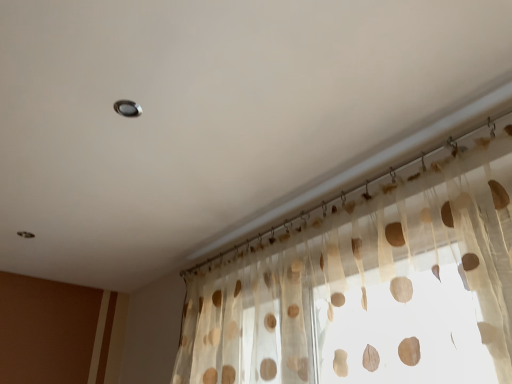
Question: Considering the relative sizes of translucent fabric curtain at upper center and metallic circular light at upper center in the image provided, is translucent fabric curtain at upper center bigger than metallic circular light at upper center?

Choices:
 (A) yes
 (B) no

Answer: (A)

Question: Is metallic circular light at upper center located within translucent fabric curtain at upper center?

Choices:
 (A) yes
 (B) no

Answer: (B)

Question: Considering the relative positions of translucent fabric curtain at upper center and metallic circular light at upper center in the image provided, is translucent fabric curtain at upper center to the left of metallic circular light at upper center from the viewer's perspective?

Choices:
 (A) no
 (B) yes

Answer: (A)

Question: Is translucent fabric curtain at upper center smaller than metallic circular light at upper center?

Choices:
 (A) no
 (B) yes

Answer: (A)

Question: From a real-world perspective, is translucent fabric curtain at upper center on top of metallic circular light at upper center?

Choices:
 (A) yes
 (B) no

Answer: (B)

Question: Is translucent fabric curtain at upper center oriented away from metallic circular light at upper center?

Choices:
 (A) no
 (B) yes

Answer: (A)

Question: Does metallic circular light at upper center touch translucent fabric curtain at upper center?

Choices:
 (A) no
 (B) yes

Answer: (A)

Question: Does metallic circular light at upper center appear on the left side of translucent fabric curtain at upper center?

Choices:
 (A) yes
 (B) no

Answer: (A)

Question: Is metallic circular light at upper center taller than translucent fabric curtain at upper center?

Choices:
 (A) no
 (B) yes

Answer: (A)

Question: Is metallic circular light at upper center positioned before translucent fabric curtain at upper center?

Choices:
 (A) yes
 (B) no

Answer: (B)

Question: From a real-world perspective, is metallic circular light at upper center below translucent fabric curtain at upper center?

Choices:
 (A) no
 (B) yes

Answer: (A)

Question: Considering the relative positions of metallic circular light at upper center and translucent fabric curtain at upper center in the image provided, is metallic circular light at upper center to the right of translucent fabric curtain at upper center from the viewer's perspective?

Choices:
 (A) no
 (B) yes

Answer: (A)

Question: Considering the positions of metallic circular light at upper center and translucent fabric curtain at upper center in the image, is metallic circular light at upper center wider or thinner than translucent fabric curtain at upper center?

Choices:
 (A) wide
 (B) thin

Answer: (B)